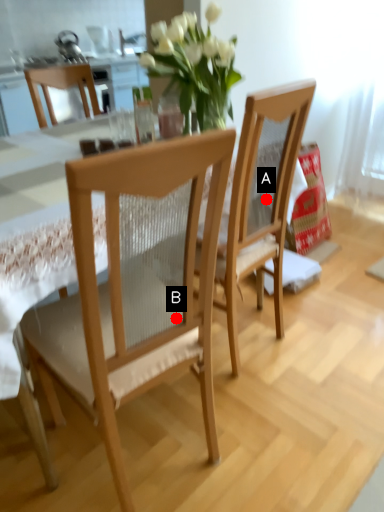
Question: Two points are circled on the image, labeled by A and B beside each circle. Among these points, which one is farthest from the camera?

Choices:
 (A) A is further
 (B) B is further

Answer: (A)